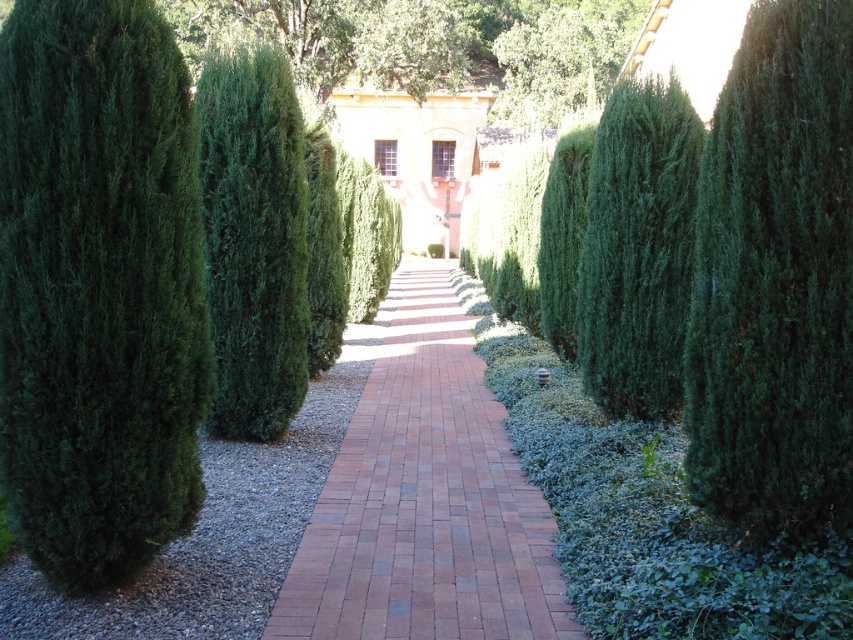
You are a gardener planning to water the green dense shrub at left and the brick at center. Which object should you water first if you want to start from the lower part of the scene?

The brick at center should be watered first because the green dense shrub at left is above it, meaning the brick is lower down in the scene.

You are a gardener planning to place a decorative stone sculpture that is 1.2 meters wide on the garden pathway. The sculpture must be centered between the green dense shrub at left and the brick at center. Considering their widths, will the sculpture fit without overlapping either object?

The green dense shrub at left has a lesser width compared to the brick at center. Since the shrub is narrower than the brick, the total space between them may still accommodate the 1.2 meter wide sculpture if the distance between their edges is sufficient. However, the exact fit depends on the spacing between the shrub and the brick, which isn

You are a gardener planning to mow the area between the green dense shrub at left and the green leafy tree at center. Based on their sizes, which one would require more space to maneuver around?

The green leafy tree at center requires more space to maneuver around since it occupies more space than the green dense shrub at left.